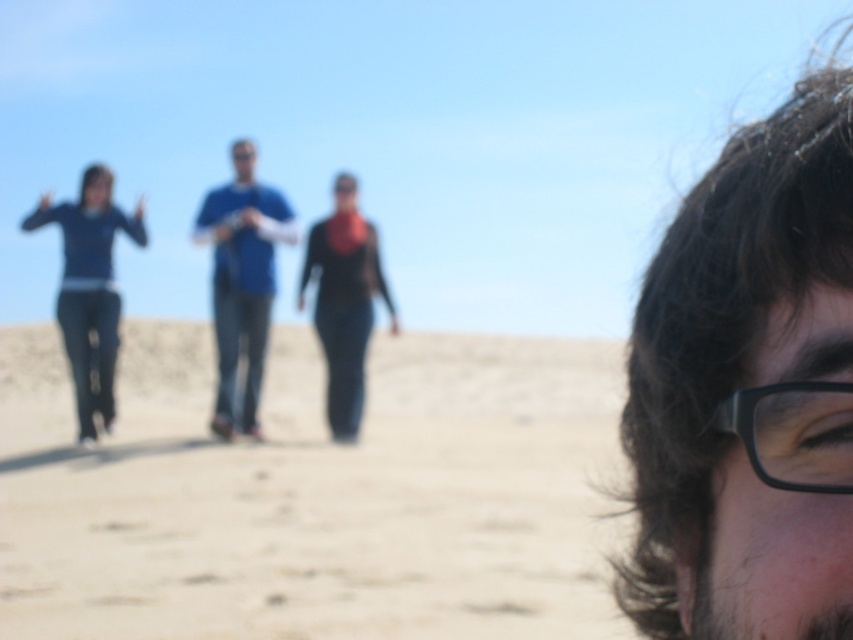
You are standing in the scene and want to place a small flag exactly where the beige sandy ground at center and the black matte jacket at center are aligned. Which object should you place the flag closer to?

The beige sandy ground at center is closer to the viewer than the black matte jacket at center, so you should place the flag closer to the beige sandy ground at center.

You are standing at the photographer position in the scene. There is a point marked at coordinates (90, 289). What object is located at that point?

The point at coordinates (90, 289) indicates blue denim jeans at left.